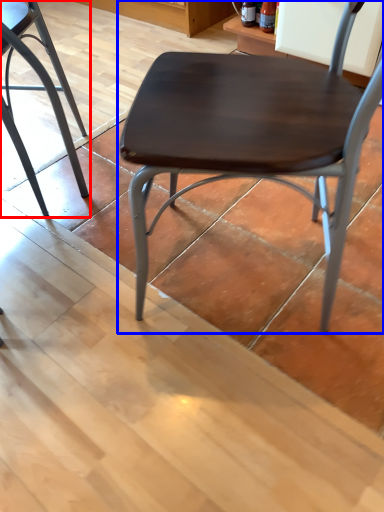
Question: Which object is further to the camera taking this photo, chair (highlighted by a red box) or chair (highlighted by a blue box)?

Choices:
 (A) chair
 (B) chair

Answer: (A)